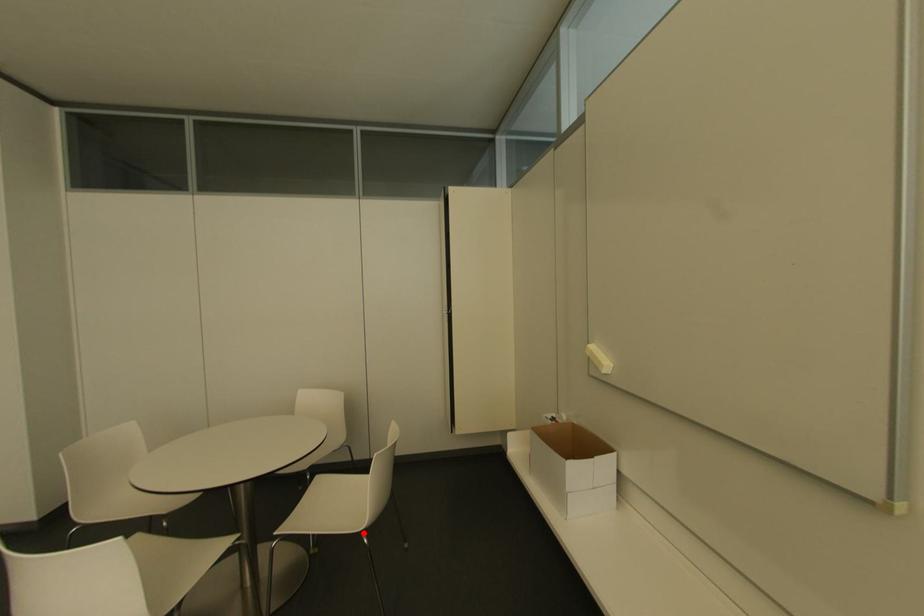
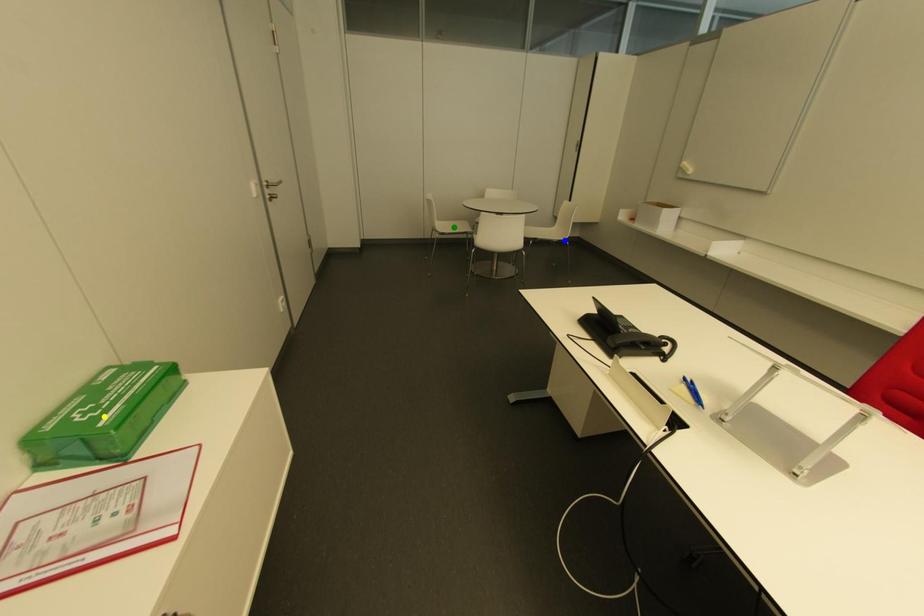
Question: I am providing you with two images of the same scene from different viewpoints. A red point is marked on the first image. You are given multiple points on the second image. Which point in image 2 is actually the same real-world point as the red point in image 1?

Choices:
 (A) green point
 (B) blue point
 (C) yellow point

Answer: (B)